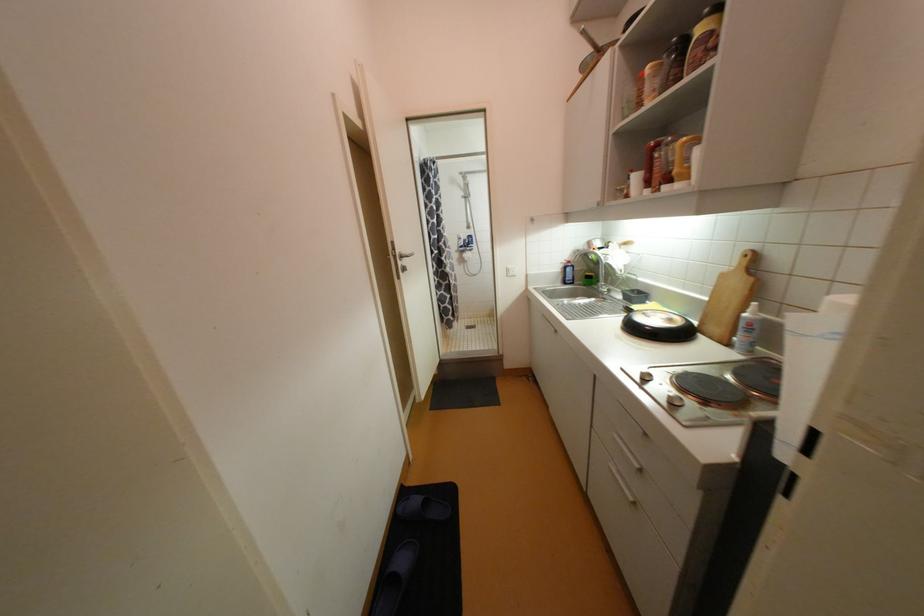
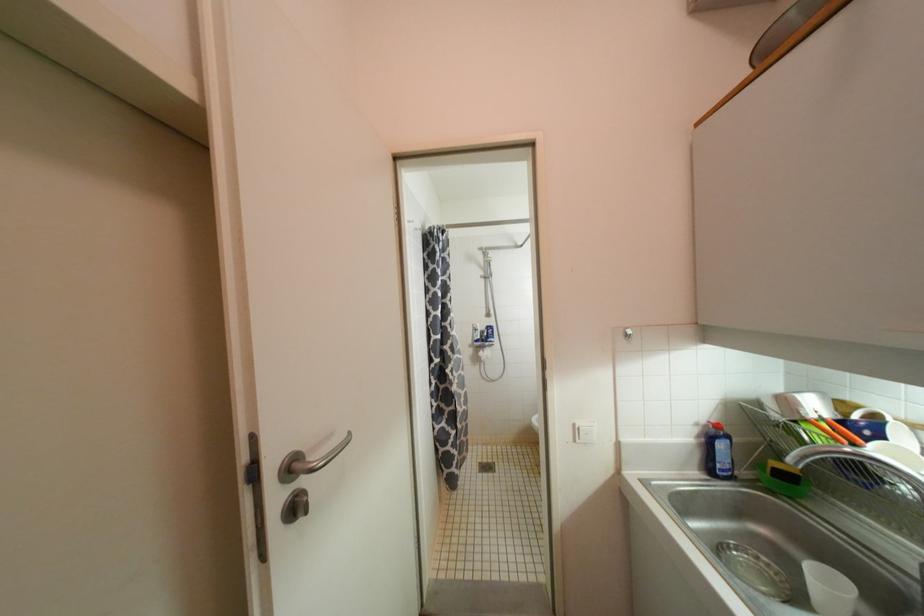
Question: What movement of the cameraman would produce the second image?

Choices:
 (A) Left
 (B) Right
 (C) Forward
 (D) Backward

Answer: (C)